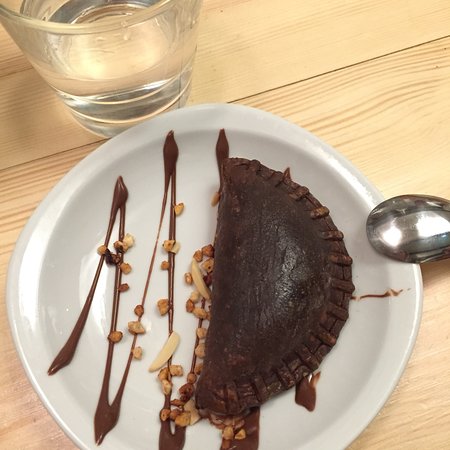
Locate an element on the screen. This screenshot has width=450, height=450. plate is located at coordinates (343, 194).